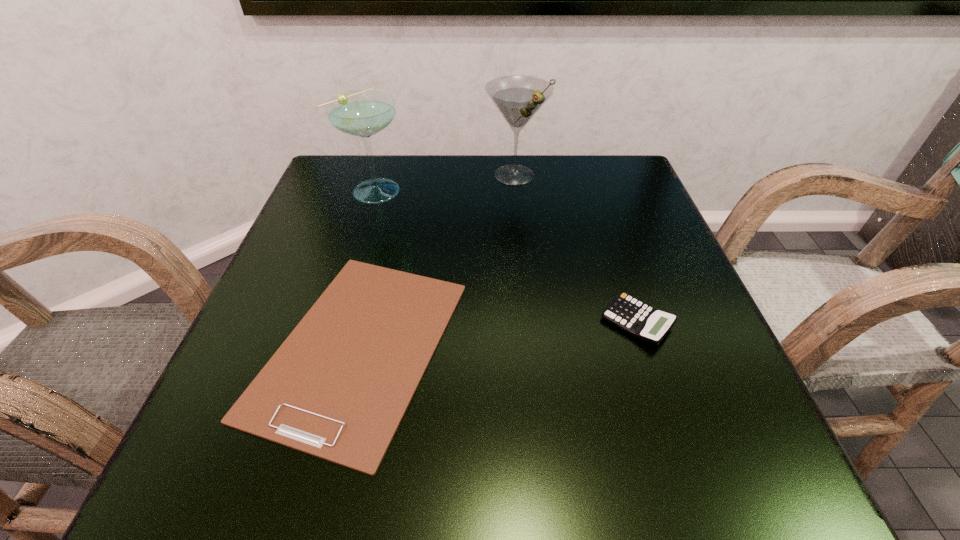
Where is `vacant space at the far right corner`? The height and width of the screenshot is (540, 960). vacant space at the far right corner is located at coordinates (595, 154).

This screenshot has height=540, width=960. I want to click on free space between the clipboard and the rightmost object, so click(498, 334).

You are a GUI agent. You are given a task and a screenshot of the screen. Output one action in this format:
    pyautogui.click(x=<x>, y=<y>)
    Task: Click on the unoccupied area between the right martini and the clipboard
    The image size is (960, 540).
    Given the screenshot: What is the action you would take?
    pyautogui.click(x=437, y=261)

Identify the location of vacant space in between the shortest object and the right martini. (437, 261).

At what (x,y) coordinates should I click in order to perform the action: click on free area in between the shortest object and the right martini. Please return your answer as a coordinate pair (x, y). Looking at the image, I should click on (437, 261).

This screenshot has width=960, height=540. Find the location of `vacant region between the clipboard and the rightmost object`. vacant region between the clipboard and the rightmost object is located at coordinates (498, 334).

Where is `free area in between the shortest object and the second object from right to left`? This screenshot has height=540, width=960. free area in between the shortest object and the second object from right to left is located at coordinates (437, 261).

In order to click on free space between the calculator and the left martini in this screenshot , I will do [506, 255].

This screenshot has height=540, width=960. What are the coordinates of `free area in between the clipboard and the rightmost object` in the screenshot? It's located at (498, 334).

Identify which object is located as the second nearest to the shortest object. Please provide its 2D coordinates. Your answer should be formatted as a tuple, i.e. [(x, y)], where the tuple contains the x and y coordinates of a point satisfying the conditions above.

[(642, 321)]